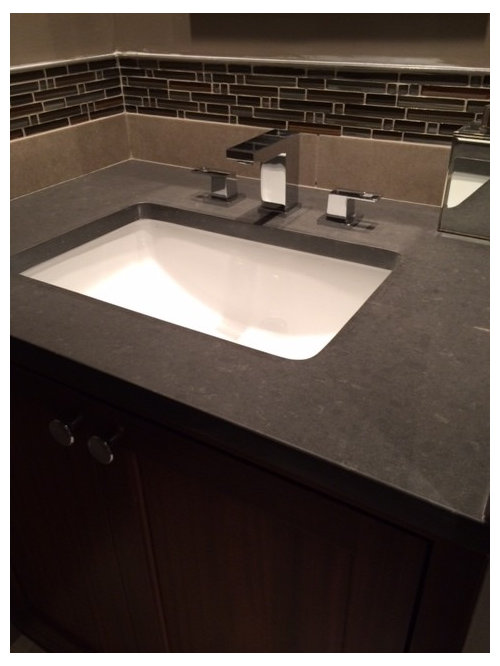
Where is `grey counter around bathroom sink`? grey counter around bathroom sink is located at coordinates (245, 388).